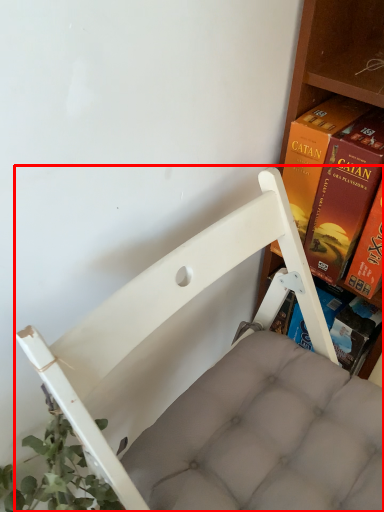
Question: Considering the relative positions of furniture (annotated by the red box) and book in the image provided, where is furniture (annotated by the red box) located with respect to the staircase?

Choices:
 (A) left
 (B) right

Answer: (A)